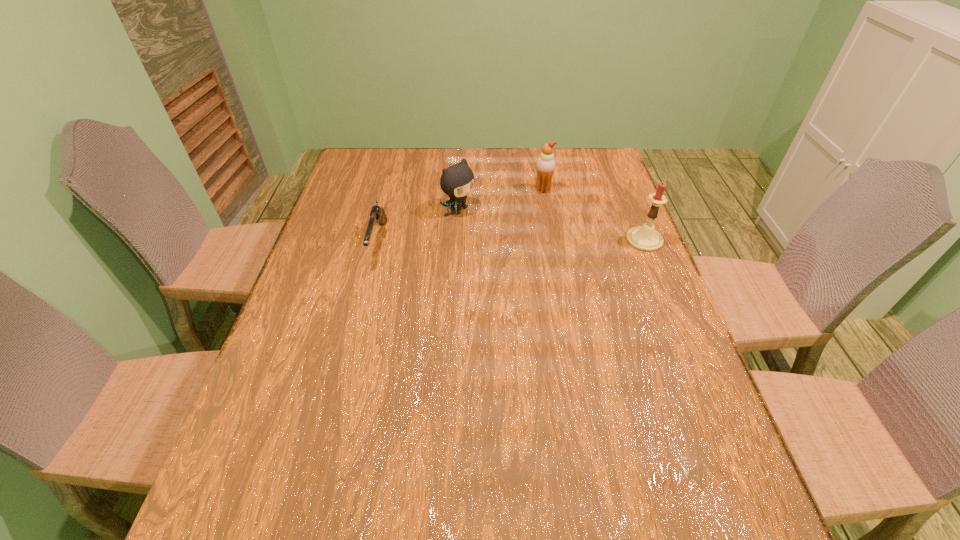
The height and width of the screenshot is (540, 960). What are the coordinates of `free space on the desktop that is between the leftmost object and the candle and is positioned on the front-facing side of the second object from left to right` in the screenshot? It's located at (510, 241).

The width and height of the screenshot is (960, 540). I want to click on vacant space on the desktop that is between the shortest object and the rightmost object and is positioned at the front with a straw on the second object from right to left, so click(471, 241).